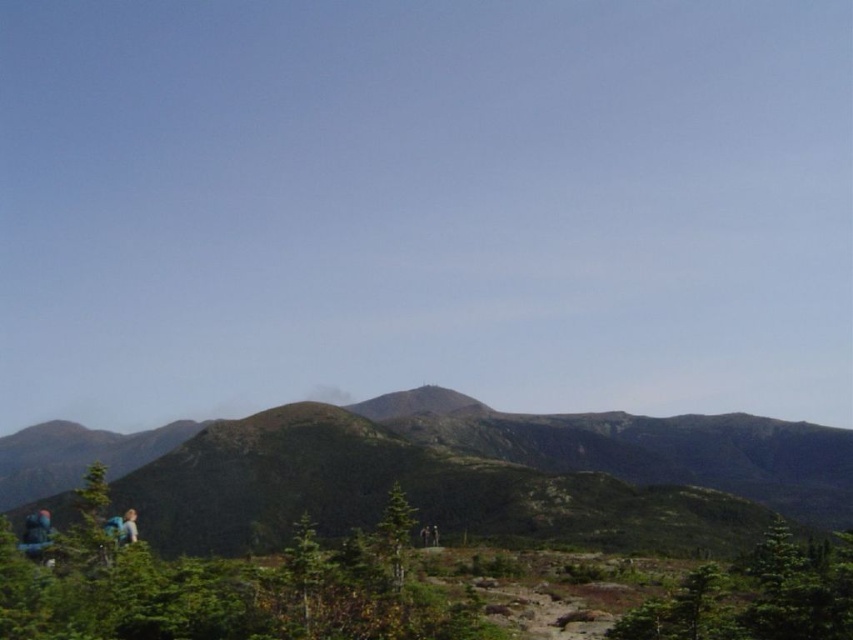
Question: Among these points, which one is nearest to the camera?

Choices:
 (A) (277, 502)
 (B) (428, 397)

Answer: (A)

Question: Observing the image, what is the correct spatial positioning of green grassy hill at center in reference to green grassy peak at center?

Choices:
 (A) right
 (B) left

Answer: (B)

Question: Among these points, which one is farthest from the camera?

Choices:
 (A) (679, 456)
 (B) (410, 410)

Answer: (B)

Question: Does green grassy hill at center have a lesser width compared to green grassy peak at center?

Choices:
 (A) yes
 (B) no

Answer: (B)

Question: Can you confirm if green grassy hill at center is smaller than green grassy peak at center?

Choices:
 (A) yes
 (B) no

Answer: (B)

Question: Which object is closer to the camera taking this photo?

Choices:
 (A) green grassy hill at center
 (B) green grassy peak at center

Answer: (A)